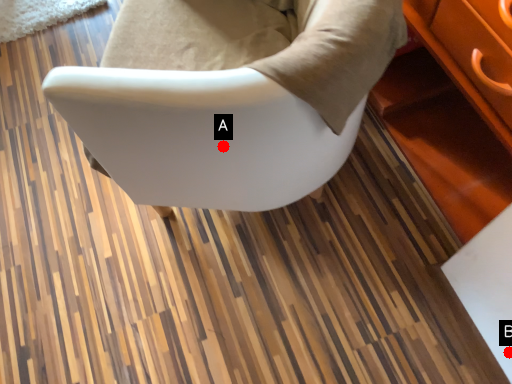
Question: Two points are circled on the image, labeled by A and B beside each circle. Which point is closer to the camera?

Choices:
 (A) A is closer
 (B) B is closer

Answer: (A)